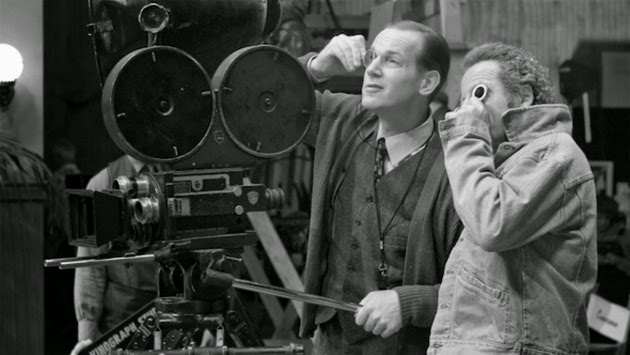
At what (x,y) coordinates should I click in order to perform the action: click on wall. Please return your answer as a coordinate pair (x, y). Looking at the image, I should click on (36, 106).